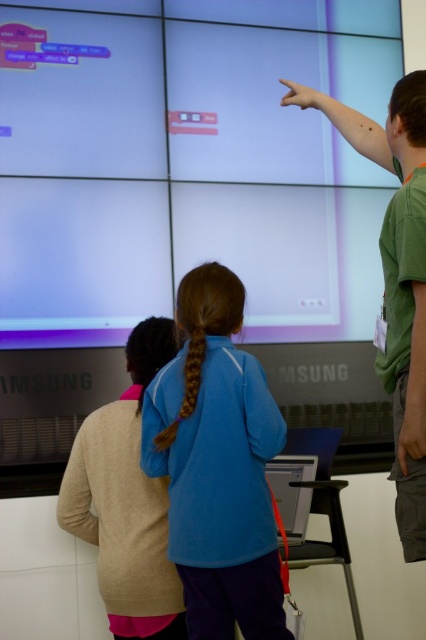
Who is more distant from viewer, (210,509) or (290,460)?

Point (290,460)

This screenshot has width=426, height=640. What are the coordinates of `blue fleece jacket at center` in the screenshot? It's located at (216, 465).

Is blue fleece jacket at center shorter than beige sweater at lower left?

In fact, blue fleece jacket at center may be taller than beige sweater at lower left.

Between point (199, 499) and point (98, 529), which one is positioned behind?

Positioned behind is point (98, 529).

The image size is (426, 640). I want to click on blue fleece jacket at center, so click(216, 465).

Can you confirm if matte white projection screen at upper center is positioned below blue fleece jacket at center?

Actually, matte white projection screen at upper center is above blue fleece jacket at center.

Based on the photo, is matte white projection screen at upper center further to the viewer compared to blue fleece jacket at center?

Yes, it is.

Image resolution: width=426 pixels, height=640 pixels. I want to click on matte white projection screen at upper center, so click(x=164, y=134).

This screenshot has width=426, height=640. In order to click on matte white projection screen at upper center in this screenshot , I will do `click(164, 134)`.